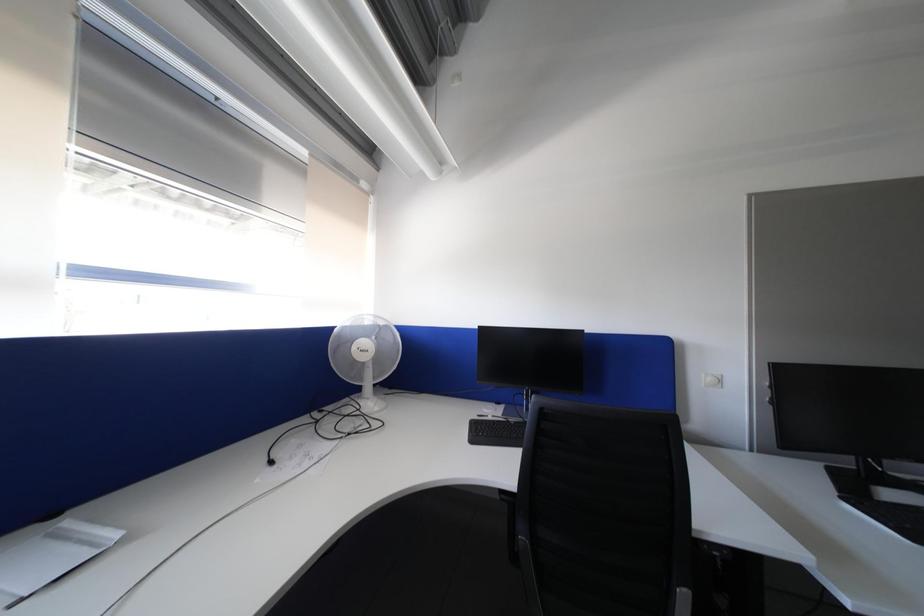
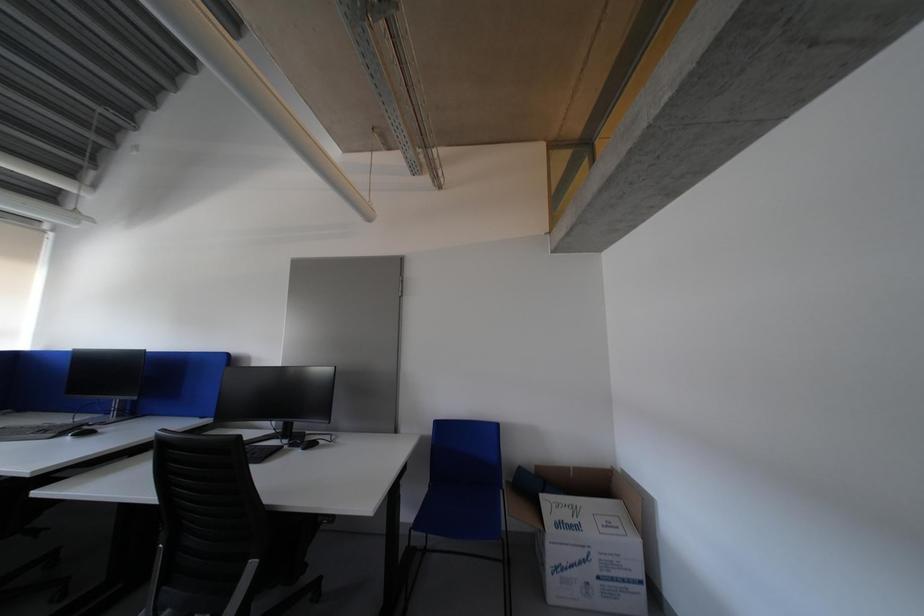
Which direction would the cameraman need to move to produce the second image?

The movement direction of the cameraman is right, backward.